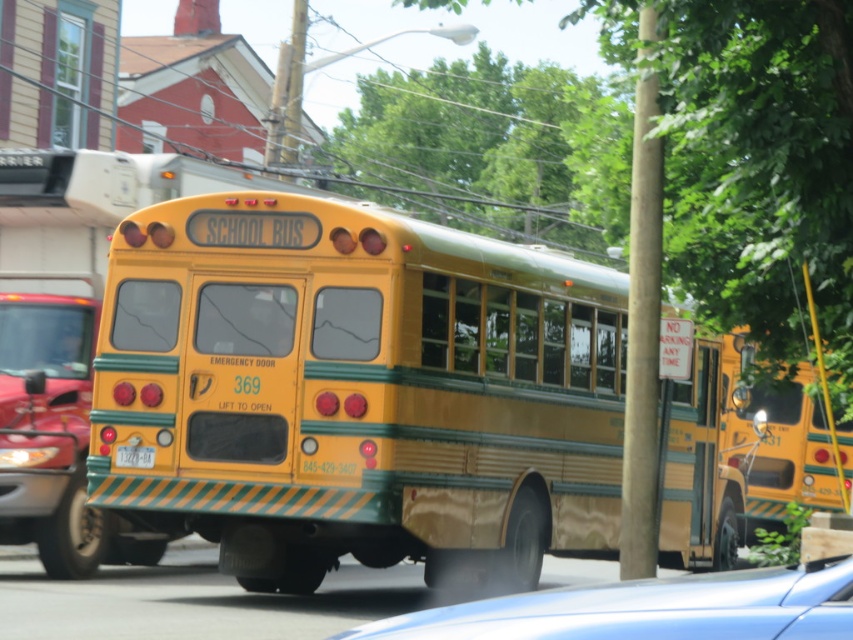
Question: Which point is farther from the camera taking this photo?

Choices:
 (A) (357, 387)
 (B) (379, 620)
 (C) (779, 416)

Answer: (C)

Question: Observing the image, what is the correct spatial positioning of metallic blue car at lower center in reference to matte yellow school bus at center?

Choices:
 (A) right
 (B) left

Answer: (B)

Question: In this image, where is metallic blue car at lower center located relative to yellow matte license plate at rear?

Choices:
 (A) right
 (B) left

Answer: (A)

Question: Which object appears closest to the camera in this image?

Choices:
 (A) yellow/golden metallic school bus at center
 (B) yellow matte license plate at rear
 (C) metallic blue car at lower center
 (D) matte yellow school bus at center

Answer: (C)

Question: Which object is farther from the camera taking this photo?

Choices:
 (A) metallic blue car at lower center
 (B) matte yellow school bus at center
 (C) yellow matte license plate at rear

Answer: (B)

Question: Does yellow/golden metallic school bus at center have a greater width compared to yellow matte license plate at rear?

Choices:
 (A) no
 (B) yes

Answer: (B)